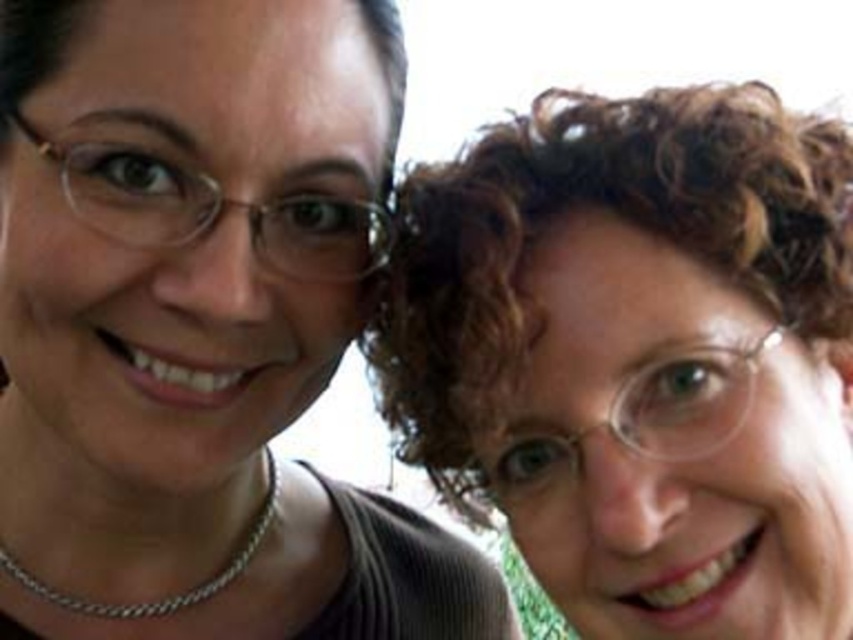
Between matte black hair at upper right and curly hair at upper right, which one is positioned higher?

curly hair at upper right is above.

Can you confirm if matte black hair at upper right is positioned to the left of curly hair at upper right?

Correct, you'll find matte black hair at upper right to the left of curly hair at upper right.

I want to click on matte black hair at upper right, so click(x=199, y=326).

At what (x,y) coordinates should I click in order to perform the action: click on matte black hair at upper right. Please return your answer as a coordinate pair (x, y). Image resolution: width=853 pixels, height=640 pixels. Looking at the image, I should click on (199, 326).

Does curly hair at upper right appear on the right side of silver chain necklace at left?

Indeed, curly hair at upper right is positioned on the right side of silver chain necklace at left.

How much distance is there between curly hair at upper right and silver chain necklace at left?

curly hair at upper right and silver chain necklace at left are 53.62 centimeters apart from each other.

Does point (733, 515) come behind point (154, 616)?

No, (733, 515) is in front of (154, 616).

Locate an element on the screen. The width and height of the screenshot is (853, 640). curly hair at upper right is located at coordinates (640, 355).

Is matte black hair at upper right wider than silver chain necklace at left?

Yes, matte black hair at upper right is wider than silver chain necklace at left.

Between point (167, 353) and point (149, 612), which one is positioned in front?

Point (167, 353)

This screenshot has width=853, height=640. Find the location of `matte black hair at upper right`. matte black hair at upper right is located at coordinates (199, 326).

The width and height of the screenshot is (853, 640). In order to click on matte black hair at upper right in this screenshot , I will do `click(199, 326)`.